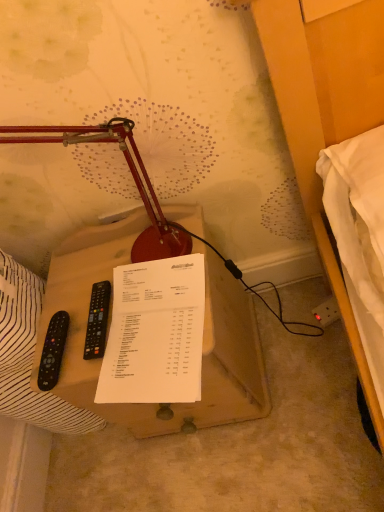
This screenshot has width=384, height=512. I want to click on free spot to the left of black plastic remote control at left, which is the 1th remote control in right-to-left order, so click(x=69, y=349).